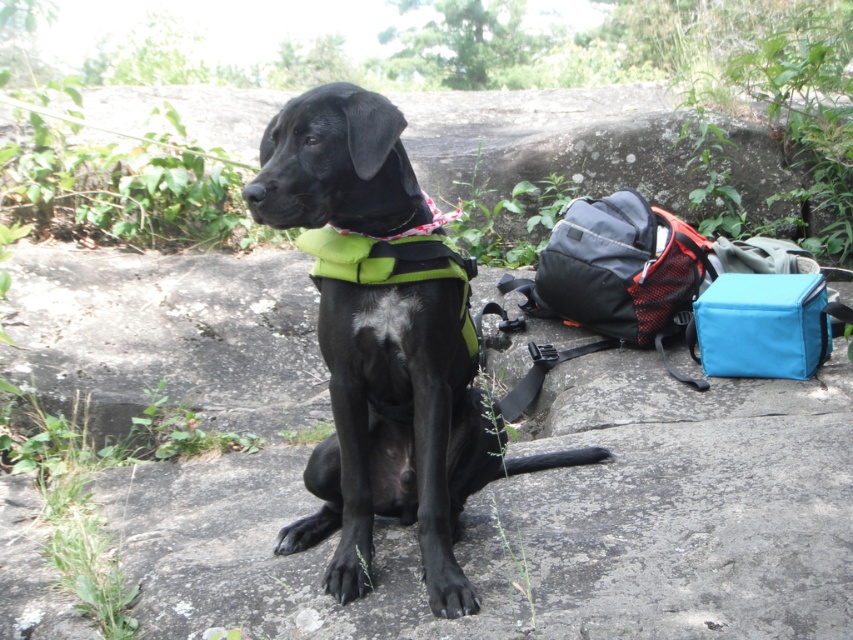
The width and height of the screenshot is (853, 640). Describe the element at coordinates (397, 426) in the screenshot. I see `shiny black dog at center` at that location.

Does shiny black dog at center lie behind red plaid neckband at center?

No.

Does point (347, 148) lie in front of point (442, 221)?

Yes, point (347, 148) is closer to viewer.

This screenshot has height=640, width=853. I want to click on shiny black dog at center, so (397, 426).